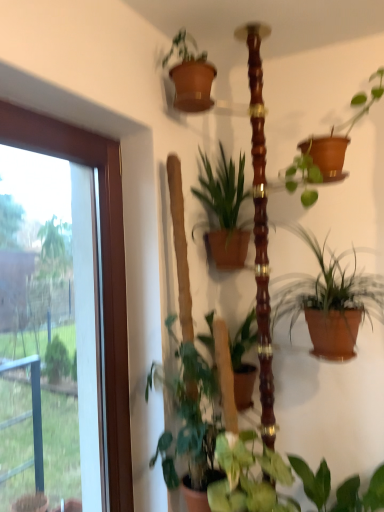
At what (x,y) coordinates should I click in order to perform the action: click on green glossy plant at center, arranged as the fourth houseplant when viewed from the top. Please return your answer as a coordinate pair (x, y). The height and width of the screenshot is (512, 384). Looking at the image, I should click on (247, 477).

Measure the distance between green matte plant at lower left, which is the third houseplant in top-to-bottom order, and camera.

The depth of green matte plant at lower left, which is the third houseplant in top-to-bottom order, is 1.25 meters.

Where is `green matte plant at center, the 1th houseplant positioned from the top`? Image resolution: width=384 pixels, height=512 pixels. green matte plant at center, the 1th houseplant positioned from the top is located at coordinates (224, 210).

How much space does terracotta clay pot at center-right, which is the 3th houseplant from bottom to top, occupy vertically?

The height of terracotta clay pot at center-right, which is the 3th houseplant from bottom to top, is 12.62 inches.

This screenshot has height=512, width=384. I want to click on terracotta clay pot at center-right, positioned as the 2th houseplant in top-to-bottom order, so click(x=329, y=300).

The height and width of the screenshot is (512, 384). What are the coordinates of `transparent glass door at left` in the screenshot? It's located at (102, 268).

In the scene shown: Which object is thinner, green glossy plant at center, arranged as the fourth houseplant when viewed from the top, or transparent glass door at left?

Thinner between the two is transparent glass door at left.

From the image's perspective, is green glossy plant at center, positioned as the 1th houseplant in bottom-to-top order, under transparent glass door at left?

Yes, from the image's perspective, green glossy plant at center, positioned as the 1th houseplant in bottom-to-top order, is beneath transparent glass door at left.

Is green glossy plant at center, positioned as the 1th houseplant in bottom-to-top order, closer to camera compared to transparent glass door at left?

No, green glossy plant at center, positioned as the 1th houseplant in bottom-to-top order, is further to the viewer.

From the image's perspective, is green matte plant at lower left, which is the third houseplant in top-to-bottom order, positioned above or below transparent glass door at left?

green matte plant at lower left, which is the third houseplant in top-to-bottom order, is below transparent glass door at left.

Considering the sizes of objects green matte plant at lower left, which is the 2th houseplant in bottom-to-top order, and transparent glass door at left in the image provided, who is taller, green matte plant at lower left, which is the 2th houseplant in bottom-to-top order, or transparent glass door at left?

transparent glass door at left is taller.

In the image, is green matte plant at lower left, which is the third houseplant in top-to-bottom order, on the left side or the right side of transparent glass door at left?

Based on their positions, green matte plant at lower left, which is the third houseplant in top-to-bottom order, is located to the right of transparent glass door at left.

Considering the positions of objects green matte plant at center, which ranks as the 4th houseplant in bottom-to-top order, and green glossy plant at center, positioned as the 1th houseplant in bottom-to-top order, in the image provided, who is more to the left, green matte plant at center, which ranks as the 4th houseplant in bottom-to-top order, or green glossy plant at center, positioned as the 1th houseplant in bottom-to-top order,?

Positioned to the left is green matte plant at center, which ranks as the 4th houseplant in bottom-to-top order.

Choose the correct answer: Is green matte plant at center, which ranks as the 4th houseplant in bottom-to-top order, inside green glossy plant at center, positioned as the 1th houseplant in bottom-to-top order, or outside it?

green matte plant at center, which ranks as the 4th houseplant in bottom-to-top order, is not inside green glossy plant at center, positioned as the 1th houseplant in bottom-to-top order, it's outside.

How different are the orientations of green matte plant at center, the 1th houseplant positioned from the top, and green glossy plant at center, positioned as the 1th houseplant in bottom-to-top order, in degrees?

The facing directions of green matte plant at center, the 1th houseplant positioned from the top, and green glossy plant at center, positioned as the 1th houseplant in bottom-to-top order, are 0.528 degrees apart.

In the scene shown: Could you tell me if green matte plant at center, which ranks as the 4th houseplant in bottom-to-top order, is turned towards green glossy plant at center, arranged as the fourth houseplant when viewed from the top?

No, green matte plant at center, which ranks as the 4th houseplant in bottom-to-top order, is not oriented towards green glossy plant at center, arranged as the fourth houseplant when viewed from the top.

Looking at their sizes, would you say transparent glass door at left is wider or thinner than green matte plant at center, the 1th houseplant positioned from the top?

Considering their sizes, transparent glass door at left looks slimmer than green matte plant at center, the 1th houseplant positioned from the top.

From their relative heights in the image, would you say transparent glass door at left is taller or shorter than green matte plant at center, the 1th houseplant positioned from the top?

Clearly, transparent glass door at left is taller compared to green matte plant at center, the 1th houseplant positioned from the top.

From the image's perspective, is transparent glass door at left above or below green matte plant at center, which ranks as the 4th houseplant in bottom-to-top order?

Clearly, from the image's perspective, transparent glass door at left is below green matte plant at center, which ranks as the 4th houseplant in bottom-to-top order.

Is transparent glass door at left further to camera compared to green matte plant at center, which ranks as the 4th houseplant in bottom-to-top order?

No.

From a real-world perspective, is green matte plant at center, the 1th houseplant positioned from the top, physically located above or below terracotta clay pot at center-right, which is the 3th houseplant from bottom to top?

From a real-world perspective, green matte plant at center, the 1th houseplant positioned from the top, is physically above terracotta clay pot at center-right, which is the 3th houseplant from bottom to top.

Is green matte plant at center, the 1th houseplant positioned from the top, in front of or behind terracotta clay pot at center-right, which is the 3th houseplant from bottom to top, in the image?

green matte plant at center, the 1th houseplant positioned from the top, is behind terracotta clay pot at center-right, which is the 3th houseplant from bottom to top.

Does green matte plant at center, which ranks as the 4th houseplant in bottom-to-top order, have a lesser width compared to terracotta clay pot at center-right, positioned as the 2th houseplant in top-to-bottom order?

Yes, green matte plant at center, which ranks as the 4th houseplant in bottom-to-top order, is thinner than terracotta clay pot at center-right, positioned as the 2th houseplant in top-to-bottom order.

Between transparent glass door at left and terracotta clay pot at center-right, positioned as the 2th houseplant in top-to-bottom order, which one has smaller width?

With smaller width is transparent glass door at left.

Which is behind, point (112, 141) or point (316, 288)?

Point (316, 288)

What are the coordinates of `window in front of the green glossy plant at center, positioned as the 1th houseplant in bottom-to-top order` in the screenshot? It's located at (102, 268).

Can you confirm if transparent glass door at left is smaller than green glossy plant at center, positioned as the 1th houseplant in bottom-to-top order?

Incorrect, transparent glass door at left is not smaller in size than green glossy plant at center, positioned as the 1th houseplant in bottom-to-top order.

From a real-world perspective, is transparent glass door at left on top of green glossy plant at center, positioned as the 1th houseplant in bottom-to-top order?

Correct, in the physical world, transparent glass door at left is higher than green glossy plant at center, positioned as the 1th houseplant in bottom-to-top order.

At what (x,y) coordinates should I click in order to perform the action: click on the 3rd houseplant to the right when counting from the transparent glass door at left. Please return your answer as a coordinate pair (x, y). Looking at the image, I should click on (247, 477).

From the image's perspective, count 1st houseplants downward from the transparent glass door at left and point to it. Please provide its 2D coordinates.

[(189, 419)]

Looking at the image, which one is located closer to green matte plant at lower left, which is the 2th houseplant in bottom-to-top order, green glossy plant at center, positioned as the 1th houseplant in bottom-to-top order, or green matte plant at center, which ranks as the 4th houseplant in bottom-to-top order?

green glossy plant at center, positioned as the 1th houseplant in bottom-to-top order.

Looking at this image, considering their positions, is transparent glass door at left positioned further to terracotta clay pot at center-right, positioned as the 2th houseplant in top-to-bottom order, than green glossy plant at center, positioned as the 1th houseplant in bottom-to-top order?

The object further to terracotta clay pot at center-right, positioned as the 2th houseplant in top-to-bottom order, is transparent glass door at left.

Based on their spatial positions, is green matte plant at center, which ranks as the 4th houseplant in bottom-to-top order, or terracotta clay pot at center-right, positioned as the 2th houseplant in top-to-bottom order, further from green glossy plant at center, arranged as the fourth houseplant when viewed from the top?

green matte plant at center, which ranks as the 4th houseplant in bottom-to-top order, lies further to green glossy plant at center, arranged as the fourth houseplant when viewed from the top, than the other object.

Looking at the image, which one is located closer to green glossy plant at center, arranged as the fourth houseplant when viewed from the top, green matte plant at lower left, which is the third houseplant in top-to-bottom order, or green matte plant at center, the 1th houseplant positioned from the top?

green matte plant at lower left, which is the third houseplant in top-to-bottom order, lies closer to green glossy plant at center, arranged as the fourth houseplant when viewed from the top, than the other object.

Considering their positions, is green matte plant at lower left, which is the third houseplant in top-to-bottom order, positioned further to transparent glass door at left than green matte plant at center, which ranks as the 4th houseplant in bottom-to-top order?

The object further to transparent glass door at left is green matte plant at center, which ranks as the 4th houseplant in bottom-to-top order.

Based on their spatial positions, is transparent glass door at left or green glossy plant at center, positioned as the 1th houseplant in bottom-to-top order, further from green matte plant at center, which ranks as the 4th houseplant in bottom-to-top order?

green glossy plant at center, positioned as the 1th houseplant in bottom-to-top order, is further to green matte plant at center, which ranks as the 4th houseplant in bottom-to-top order.

Looking at this image, estimate the real-world distances between objects in this image. Which object is further from transparent glass door at left, green matte plant at center, which ranks as the 4th houseplant in bottom-to-top order, or green glossy plant at center, arranged as the fourth houseplant when viewed from the top?

green glossy plant at center, arranged as the fourth houseplant when viewed from the top, is positioned further to the anchor transparent glass door at left.

Which object lies nearer to the anchor point green matte plant at center, which ranks as the 4th houseplant in bottom-to-top order, transparent glass door at left or terracotta clay pot at center-right, positioned as the 2th houseplant in top-to-bottom order?

terracotta clay pot at center-right, positioned as the 2th houseplant in top-to-bottom order, is closer to green matte plant at center, which ranks as the 4th houseplant in bottom-to-top order.

This screenshot has height=512, width=384. In order to click on houseplant between terracotta clay pot at center-right, positioned as the 2th houseplant in top-to-bottom order, and green glossy plant at center, arranged as the fourth houseplant when viewed from the top, from top to bottom in this screenshot , I will do click(189, 419).

This screenshot has width=384, height=512. I want to click on window between green matte plant at center, which ranks as the 4th houseplant in bottom-to-top order, and green glossy plant at center, arranged as the fourth houseplant when viewed from the top, from top to bottom, so click(x=102, y=268).

Locate an element on the screen. This screenshot has width=384, height=512. window between green matte plant at center, which ranks as the 4th houseplant in bottom-to-top order, and green matte plant at lower left, which is the 2th houseplant in bottom-to-top order, in the vertical direction is located at coordinates (102, 268).

You are a GUI agent. You are given a task and a screenshot of the screen. Output one action in this format:
    pyautogui.click(x=<x>, y=<y>)
    Task: Click on the houseplant between green matte plant at center, which ranks as the 4th houseplant in bottom-to-top order, and green matte plant at lower left, which is the 2th houseplant in bottom-to-top order, vertically
    This screenshot has height=512, width=384.
    Given the screenshot: What is the action you would take?
    pyautogui.click(x=329, y=300)